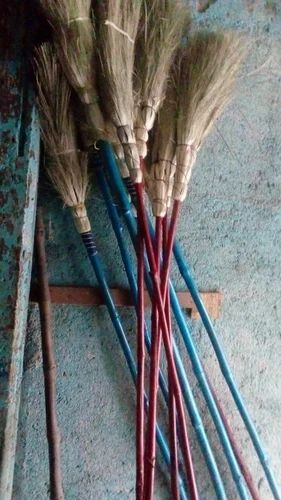
Locate an element on the screen. The height and width of the screenshot is (500, 281). broom is located at coordinates (167, 118).